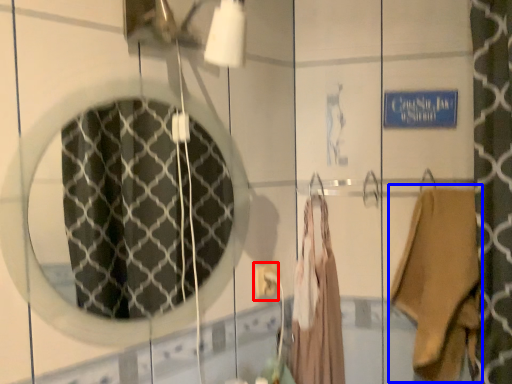
Question: Which object is further to the camera taking this photo, electric outlet (highlighted by a red box) or clothing (highlighted by a blue box)?

Choices:
 (A) electric outlet
 (B) clothing

Answer: (A)